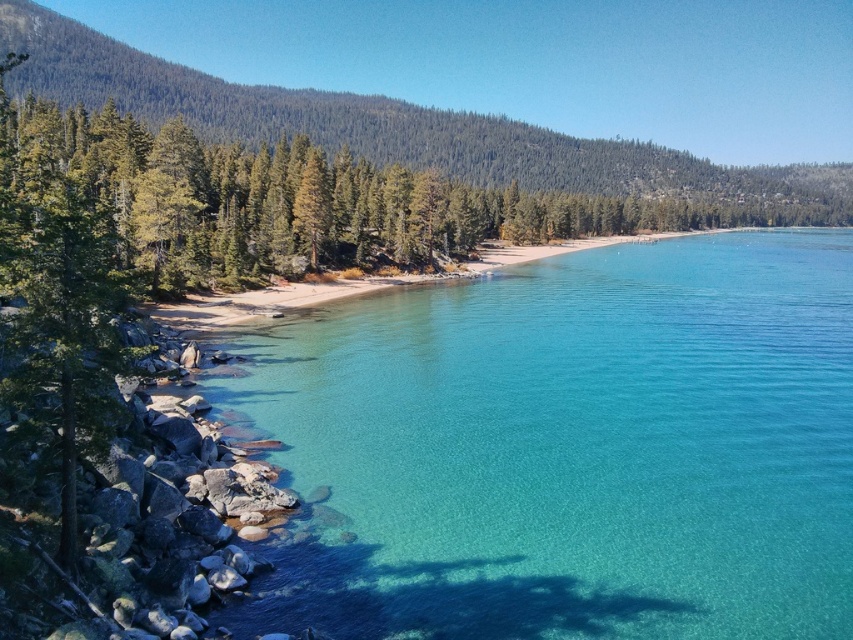
Question: Which point is closer to the camera?

Choices:
 (A) clear glassy water at center
 (B) green matte tree at left

Answer: (B)

Question: Is clear glassy water at center thinner than green matte tree at left?

Choices:
 (A) yes
 (B) no

Answer: (B)

Question: Considering the relative positions of clear glassy water at center and green matte tree at left in the image provided, where is clear glassy water at center located with respect to green matte tree at left?

Choices:
 (A) left
 (B) right

Answer: (B)

Question: Does clear glassy water at center appear over green matte tree at left?

Choices:
 (A) yes
 (B) no

Answer: (B)

Question: Among these points, which one is farthest from the camera?

Choices:
 (A) (366, 477)
 (B) (117, 355)

Answer: (A)

Question: Which point is farther from the camera taking this photo?

Choices:
 (A) (93, 346)
 (B) (534, 337)

Answer: (B)